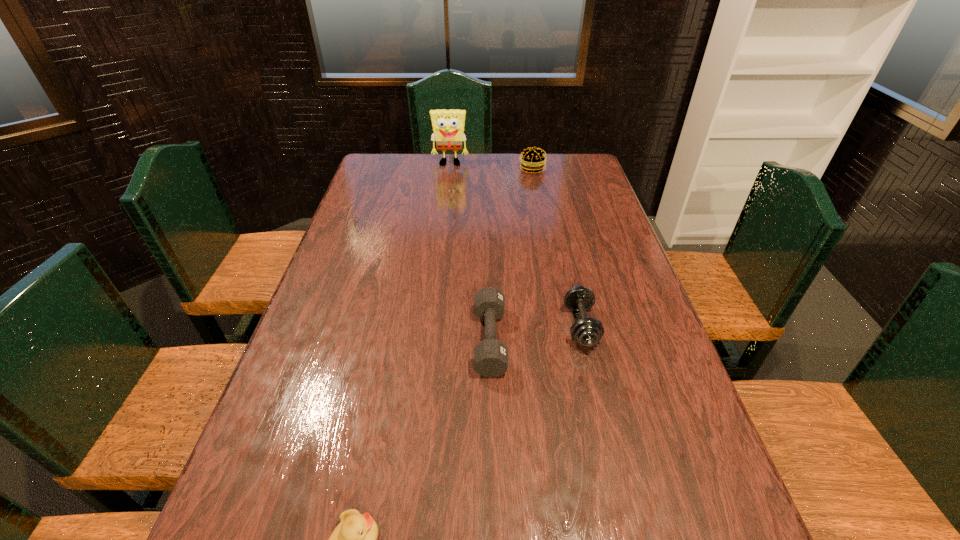
The width and height of the screenshot is (960, 540). I want to click on object present at the right edge, so click(x=587, y=332).

Where is `vacant space at the far edge of the desktop`? vacant space at the far edge of the desktop is located at coordinates (425, 154).

At what (x,y) coordinates should I click in order to perform the action: click on free space at the left edge. Please return your answer as a coordinate pair (x, y). The height and width of the screenshot is (540, 960). Looking at the image, I should click on (293, 356).

In the image, there is a desktop. Where is `vacant area at the right edge`? vacant area at the right edge is located at coordinates (603, 235).

Where is `free space at the far left corner of the desktop`? free space at the far left corner of the desktop is located at coordinates (381, 161).

In the image, there is a desktop. Identify the location of vacant space at the far right corner. This screenshot has height=540, width=960. (562, 167).

Image resolution: width=960 pixels, height=540 pixels. I want to click on free space between the left dumbbell and the sponge, so click(470, 252).

Where is `free spot between the patty and the left dumbbell`? free spot between the patty and the left dumbbell is located at coordinates (511, 254).

Image resolution: width=960 pixels, height=540 pixels. In order to click on free area in between the left dumbbell and the tallest object in this screenshot , I will do `click(470, 252)`.

Image resolution: width=960 pixels, height=540 pixels. Identify the location of free space between the third object from right to left and the patty. (511, 254).